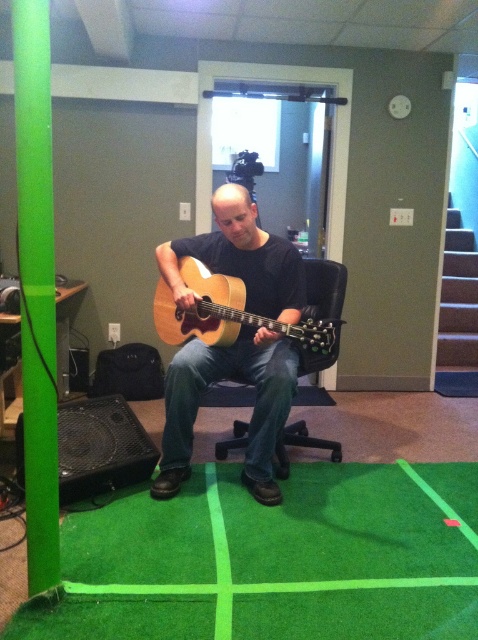
You are standing in the basement room where the man is playing the guitar. There are two points marked in the room. The first point is at coordinates point (241, 264) and the second point is at point (290, 428). If you want to move from the first point to the second point, which direction should you move relative to the man?

To move from point (241, 264) to point (290, 428), you should move towards the direction away from the man since point (241, 264) is in front of point (290, 428).

You are a delivery person who needs to place a large package on the floor between the light brown acoustic guitar at center and the black plastic swivel chair at center. Can you fit it there if the package is as wide as the guitar?

The light brown acoustic guitar at center is wider than the black plastic swivel chair at center. Since the package is as wide as the guitar, it may not fit between them unless there is enough space. However, the description only mentions their widths, not the distance between them. Without knowing the distance between the guitar and chair, it is impossible to determine if the package will fit.